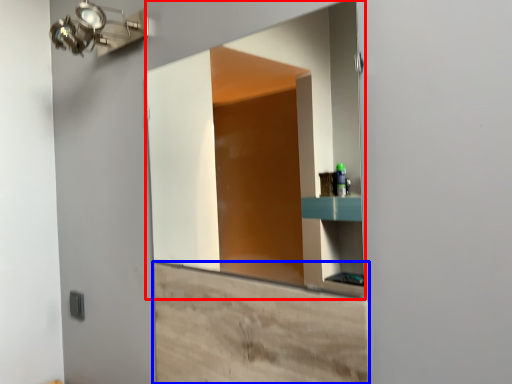
Question: Which object is closer to the camera taking this photo, mirror (highlighted by a red box) or cabinetry (highlighted by a blue box)?

Choices:
 (A) mirror
 (B) cabinetry

Answer: (B)